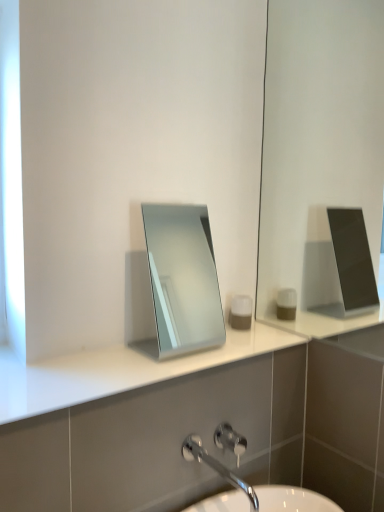
Question: In terms of height, does brushed metal shower at lower center look taller or shorter compared to matte gray container at center?

Choices:
 (A) short
 (B) tall

Answer: (A)

Question: From a real-world perspective, is brushed metal shower at lower center positioned above or below matte gray container at center?

Choices:
 (A) above
 (B) below

Answer: (B)

Question: Which object is the farthest from the white glossy counter top at center?

Choices:
 (A) silver metallic mirror at center
 (B) matte gray container at center
 (C) brushed metal shower at lower center
 (D) chrome metallic faucet at lower center

Answer: (A)

Question: Which is farther from the white glossy counter top at center?

Choices:
 (A) chrome metallic faucet at lower center
 (B) silver metallic mirror at center
 (C) brushed metal shower at lower center
 (D) matte gray container at center

Answer: (B)